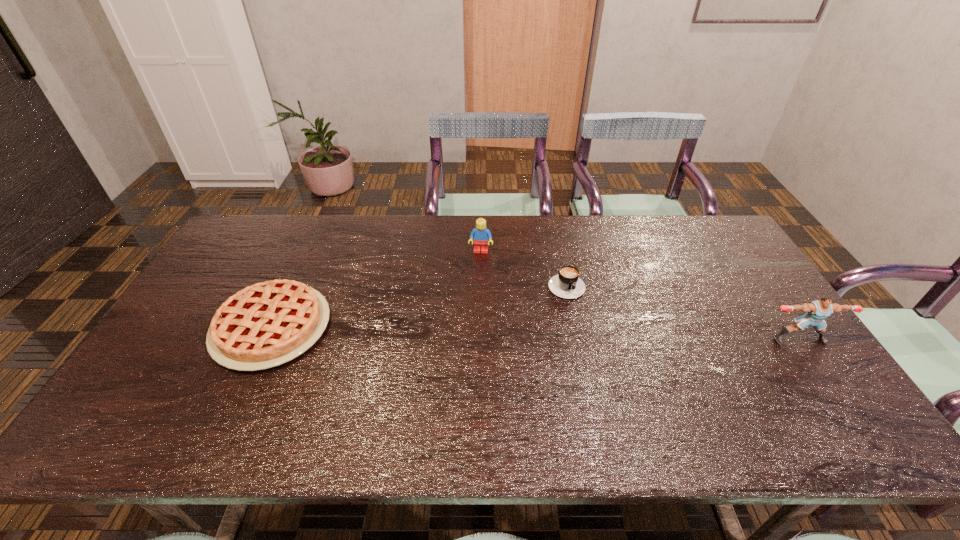
Where is `free space at the right edge`? The image size is (960, 540). free space at the right edge is located at coordinates (708, 267).

What are the coordinates of `vacant area at the far left corner of the desktop` in the screenshot? It's located at (251, 250).

I want to click on free spot between the second object from left to right and the leftmost object, so click(x=376, y=289).

Find the location of a particular element. free space between the farthest object and the tallest object is located at coordinates (640, 295).

Find the location of a particular element. This screenshot has height=540, width=960. unoccupied area between the leftmost object and the cappuccino is located at coordinates click(419, 305).

Locate an element on the screen. The width and height of the screenshot is (960, 540). free spot between the second object from right to left and the leftmost object is located at coordinates (419, 305).

This screenshot has height=540, width=960. Identify the location of vacant space in between the tallest object and the pie. (536, 333).

This screenshot has height=540, width=960. I want to click on free spot between the leftmost object and the third object from left to right, so click(x=419, y=305).

Identify the location of empty space that is in between the cappuccino and the farthest object. Image resolution: width=960 pixels, height=540 pixels. (523, 267).

The height and width of the screenshot is (540, 960). Find the location of `vacant area between the cappuccino and the second tallest object`. vacant area between the cappuccino and the second tallest object is located at coordinates (523, 267).